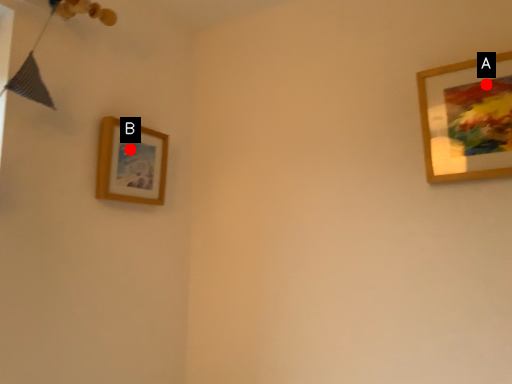
Question: Two points are circled on the image, labeled by A and B beside each circle. Which point is farther from the camera taking this photo?

Choices:
 (A) A is further
 (B) B is further

Answer: (B)